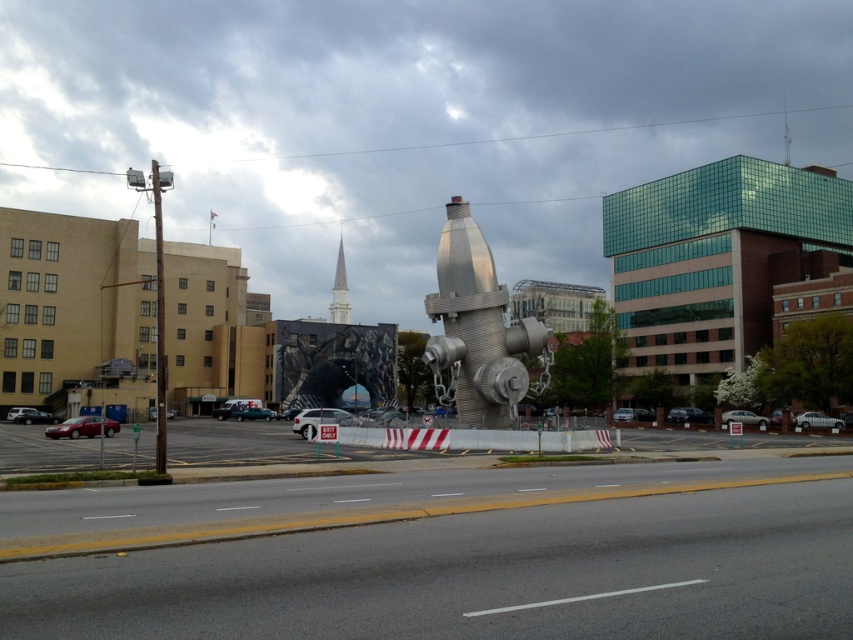
Does brushed metal fire hydrant at center appear on the left side of silver metallic spire at upper center?

Incorrect, brushed metal fire hydrant at center is not on the left side of silver metallic spire at upper center.

Does brushed metal fire hydrant at center appear over silver metallic spire at upper center?

Actually, brushed metal fire hydrant at center is below silver metallic spire at upper center.

Locate an element on the screen. The image size is (853, 640). brushed metal fire hydrant at center is located at coordinates (476, 328).